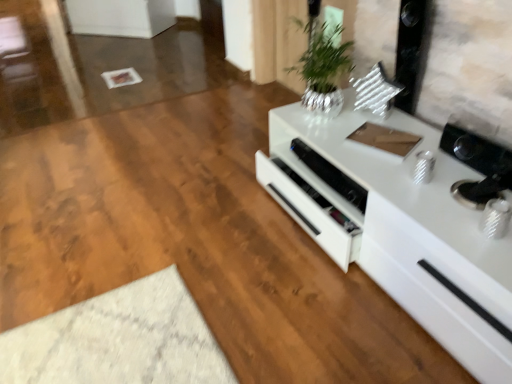
Question: Can you confirm if white glossy speaker at center is wider than silver metallic vase at upper center?

Choices:
 (A) yes
 (B) no

Answer: (B)

Question: Considering the relative positions of white glossy speaker at center and silver metallic vase at upper center in the image provided, is white glossy speaker at center to the left of silver metallic vase at upper center from the viewer's perspective?

Choices:
 (A) yes
 (B) no

Answer: (B)

Question: Is white glossy speaker at center further to the viewer compared to silver metallic vase at upper center?

Choices:
 (A) yes
 (B) no

Answer: (A)

Question: Is white glossy speaker at center not close to silver metallic vase at upper center?

Choices:
 (A) yes
 (B) no

Answer: (B)

Question: From a real-world perspective, is white glossy speaker at center on top of silver metallic vase at upper center?

Choices:
 (A) no
 (B) yes

Answer: (A)

Question: Does white glossy speaker at center turn towards silver metallic vase at upper center?

Choices:
 (A) no
 (B) yes

Answer: (A)

Question: Can you confirm if silver metallic vase at upper center is wider than white glossy speaker at center?

Choices:
 (A) no
 (B) yes

Answer: (B)

Question: Can you confirm if silver metallic vase at upper center is bigger than white glossy speaker at center?

Choices:
 (A) no
 (B) yes

Answer: (B)

Question: Is there a large distance between silver metallic vase at upper center and white glossy speaker at center?

Choices:
 (A) no
 (B) yes

Answer: (A)

Question: From a real-world perspective, does silver metallic vase at upper center sit lower than white glossy speaker at center?

Choices:
 (A) no
 (B) yes

Answer: (A)

Question: Is silver metallic vase at upper center further to the viewer compared to white glossy speaker at center?

Choices:
 (A) yes
 (B) no

Answer: (B)

Question: From a real-world perspective, does silver metallic vase at upper center stand above white glossy speaker at center?

Choices:
 (A) no
 (B) yes

Answer: (B)

Question: From a real-world perspective, is white glossy speaker at center on top of white glossy cabinet at right?

Choices:
 (A) yes
 (B) no

Answer: (A)